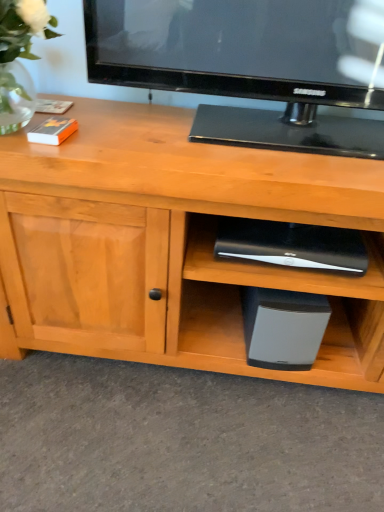
Question: From the image's perspective, relative to black matte speaker at lower center, which is the first appliance in bottom-to-top order, is black plastic speaker at lower center, the second appliance when ordered from bottom to top, above or below?

Choices:
 (A) below
 (B) above

Answer: (B)

Question: In terms of height, does black plastic speaker at lower center, placed as the 1th appliance when sorted from top to bottom, look taller or shorter compared to black matte speaker at lower center, which is the first appliance in bottom-to-top order?

Choices:
 (A) short
 (B) tall

Answer: (A)

Question: Estimate the real-world distances between objects in this image. Which object is farther from the black plastic speaker at lower center, placed as the 1th appliance when sorted from top to bottom?

Choices:
 (A) black matte speaker at lower center, the 2th appliance in the top-to-bottom sequence
 (B) clear glass vase at upper left

Answer: (B)

Question: Which is farther from the clear glass vase at upper left?

Choices:
 (A) black matte speaker at lower center, the 2th appliance in the top-to-bottom sequence
 (B) black plastic speaker at lower center, placed as the 1th appliance when sorted from top to bottom

Answer: (A)